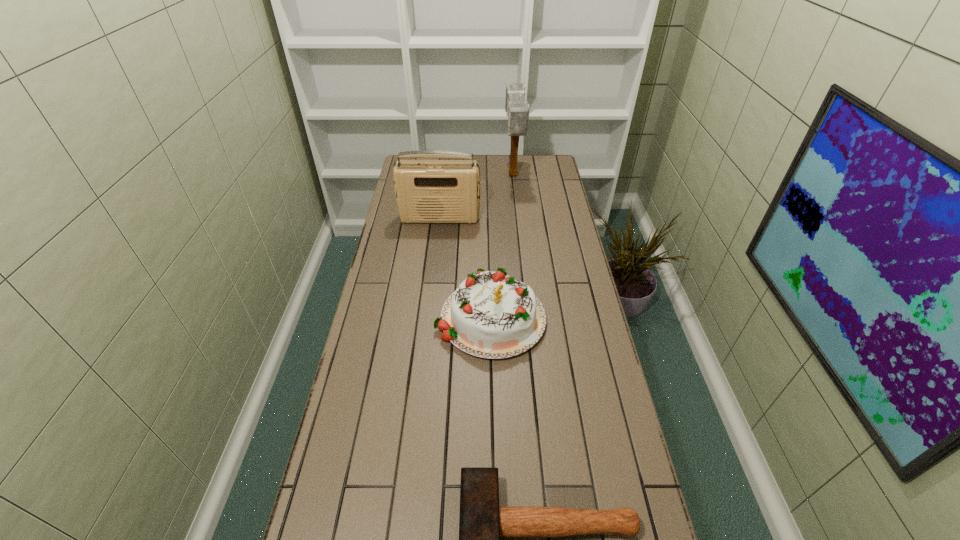
Where is `blank space that satisfies the following two spatial constraints: 1. on the front-facing side of the radio receiver; 2. on the right side of the cake`? The height and width of the screenshot is (540, 960). blank space that satisfies the following two spatial constraints: 1. on the front-facing side of the radio receiver; 2. on the right side of the cake is located at coordinates (429, 315).